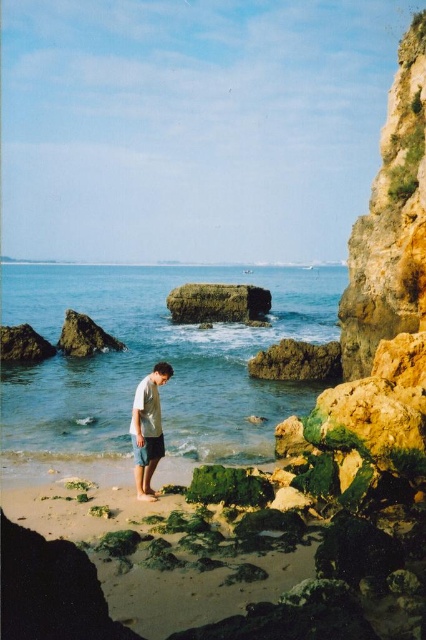
You are a photographer trying to capture the clear blue water at center in your shot. Based on the scene, where should you position your camera to ensure the water is centered in the frame?

To center the clear blue water at center in your frame, position your camera so that the water is aligned with the point at coordinates 0.562 on the horizontal axis and 0.369 on the vertical axis.

You are standing on the beach and want to walk from the person to the clear blue water at center. How many steps would you need to take if each step covers about 3 feet?

The distance between the person and the clear blue water at center is 81.06 feet. Since each step covers about 3 feet, you would need to take approximately 27 steps to reach the clear blue water at center.

You are a lifeguard on duty and notice someone at the beach. You see the clear blue water at center and the light gray cotton shorts at center. Is the person in the water or on the shore?

The clear blue water at center is above light gray cotton shorts at center, indicating that the water is above the shorts. This means the person is in the water.